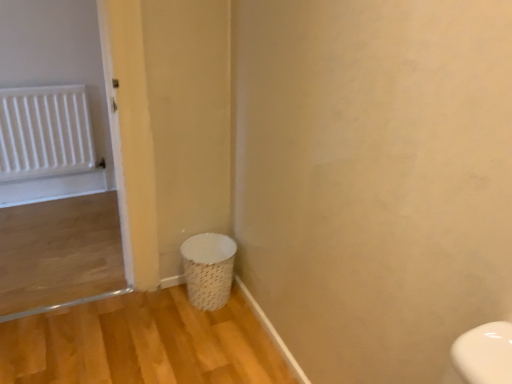
Question: From the image's perspective, does white plastic radiator at upper left appear lower than white woven laundry basket at lower left?

Choices:
 (A) no
 (B) yes

Answer: (A)

Question: Does white plastic radiator at upper left have a smaller size compared to white woven laundry basket at lower left?

Choices:
 (A) no
 (B) yes

Answer: (B)

Question: Considering the relative sizes of white plastic radiator at upper left and white woven laundry basket at lower left in the image provided, is white plastic radiator at upper left thinner than white woven laundry basket at lower left?

Choices:
 (A) yes
 (B) no

Answer: (A)

Question: Is white plastic radiator at upper left facing towards white woven laundry basket at lower left?

Choices:
 (A) yes
 (B) no

Answer: (A)

Question: From the image's perspective, is white plastic radiator at upper left on top of white woven laundry basket at lower left?

Choices:
 (A) no
 (B) yes

Answer: (B)

Question: Considering the relative positions of white plastic radiator at upper left and white woven laundry basket at lower left in the image provided, is white plastic radiator at upper left behind white woven laundry basket at lower left?

Choices:
 (A) no
 (B) yes

Answer: (B)

Question: Can you confirm if white woven laundry basket at lower left is positioned to the right of white plastic radiator at upper left?

Choices:
 (A) no
 (B) yes

Answer: (B)

Question: Is white woven laundry basket at lower left positioned with its back to white plastic radiator at upper left?

Choices:
 (A) yes
 (B) no

Answer: (B)

Question: From a real-world perspective, is white woven laundry basket at lower left beneath white plastic radiator at upper left?

Choices:
 (A) no
 (B) yes

Answer: (B)

Question: Is white woven laundry basket at lower left not close to white plastic radiator at upper left?

Choices:
 (A) yes
 (B) no

Answer: (A)

Question: Does white woven laundry basket at lower left have a lesser width compared to white plastic radiator at upper left?

Choices:
 (A) yes
 (B) no

Answer: (B)

Question: From the image's perspective, is white woven laundry basket at lower left below white plastic radiator at upper left?

Choices:
 (A) no
 (B) yes

Answer: (B)

Question: Considering the positions of white woven laundry basket at lower left and white plastic radiator at upper left in the image, is white woven laundry basket at lower left bigger or smaller than white plastic radiator at upper left?

Choices:
 (A) big
 (B) small

Answer: (A)